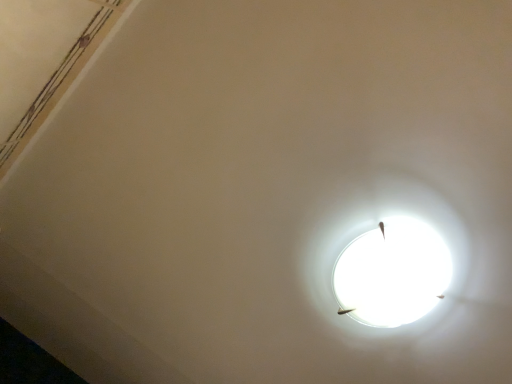
This screenshot has width=512, height=384. What do you see at coordinates (386, 254) in the screenshot?
I see `white glossy stage light at upper center` at bounding box center [386, 254].

You are a GUI agent. You are given a task and a screenshot of the screen. Output one action in this format:
    pyautogui.click(x=<x>, y=<y>)
    Task: Click on the white glossy stage light at upper center
    Image resolution: width=512 pixels, height=384 pixels.
    Given the screenshot: What is the action you would take?
    pyautogui.click(x=386, y=254)

The image size is (512, 384). What are the coordinates of `white glossy stage light at upper center` in the screenshot? It's located at (386, 254).